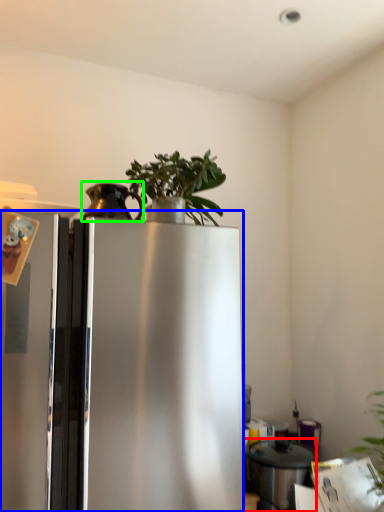
Question: Based on their relative distances, which object is farther from appliance (highlighted by a red box)? Choose from refrigerator (highlighted by a blue box) and appliance (highlighted by a green box).

Choices:
 (A) refrigerator
 (B) appliance

Answer: (B)